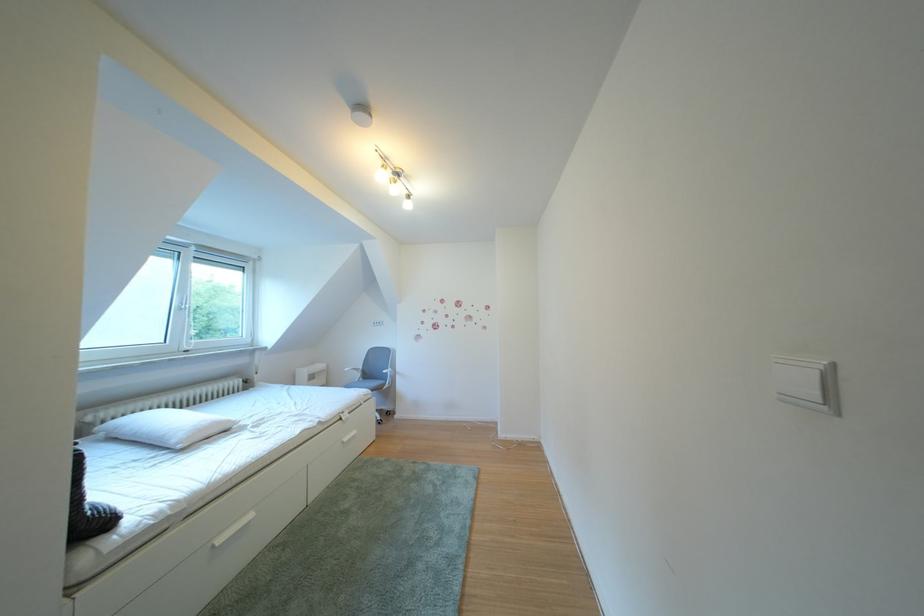
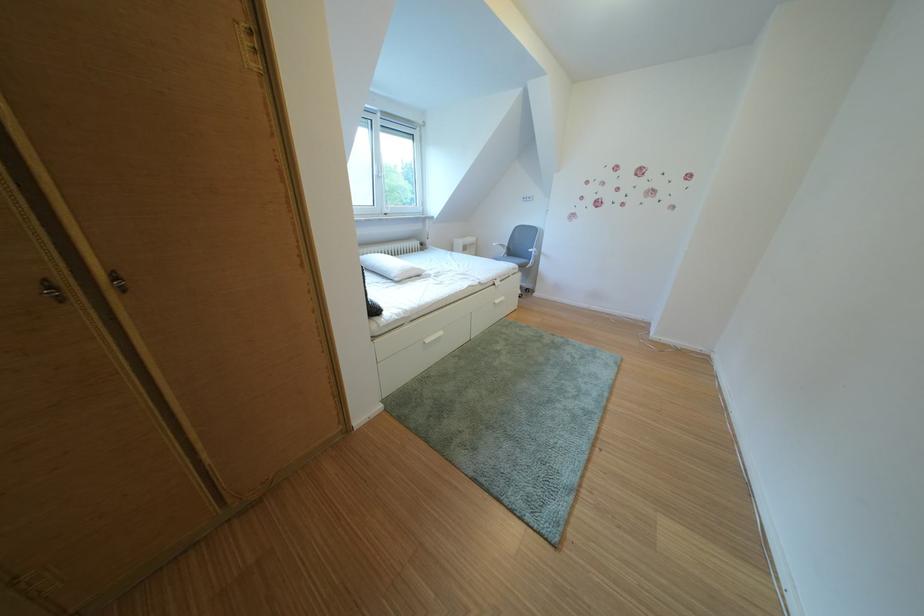
In the second image, find the point that corresponds to the point at 144,413 in the first image.

(380, 256)